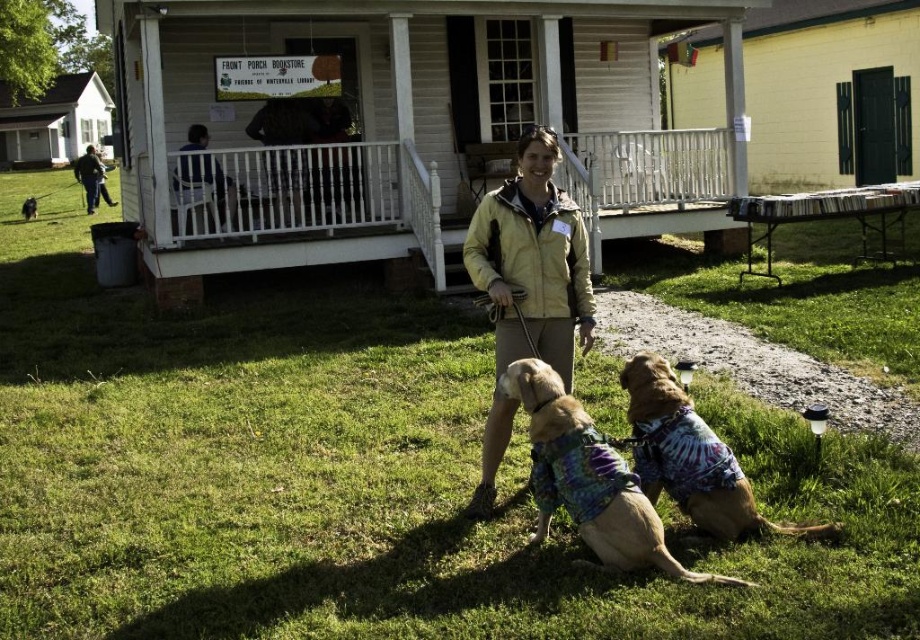
Question: Among these points, which one is farthest from the camera?

Choices:
 (A) (173, 252)
 (B) (539, 486)
 (C) (416, 22)
 (D) (29, 204)

Answer: (D)

Question: Where is light yellow jacket at center located in relation to tie-dye fabric dog at center in the image?

Choices:
 (A) left
 (B) right

Answer: (A)

Question: Is white wooden porch at upper center smaller than light yellow jacket at center?

Choices:
 (A) yes
 (B) no

Answer: (A)

Question: Which object is farther from the camera taking this photo?

Choices:
 (A) light yellow jacket at center
 (B) green grass at lower center
 (C) tie-dye fabric dog at center

Answer: (A)

Question: Observing the image, what is the correct spatial positioning of green grass at lower center in reference to multicolored fabric dog at lower right?

Choices:
 (A) below
 (B) above

Answer: (B)

Question: Estimate the real-world distances between objects in this image. Which object is farther from the blue shirt at upper center?

Choices:
 (A) light yellow jacket at center
 (B) tie-dye fabric dog at center
 (C) green grass at lower center
 (D) multicolored fabric dog at lower right

Answer: (D)